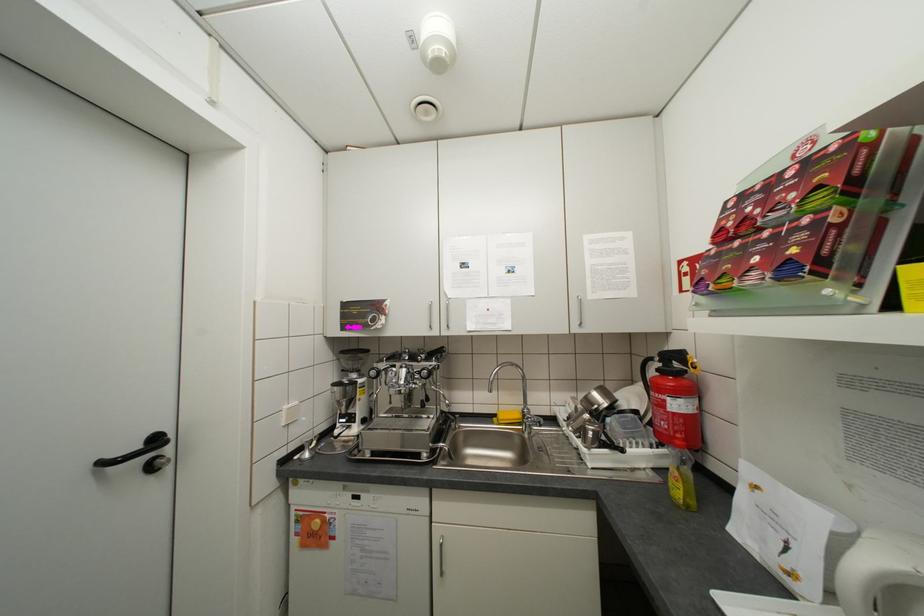
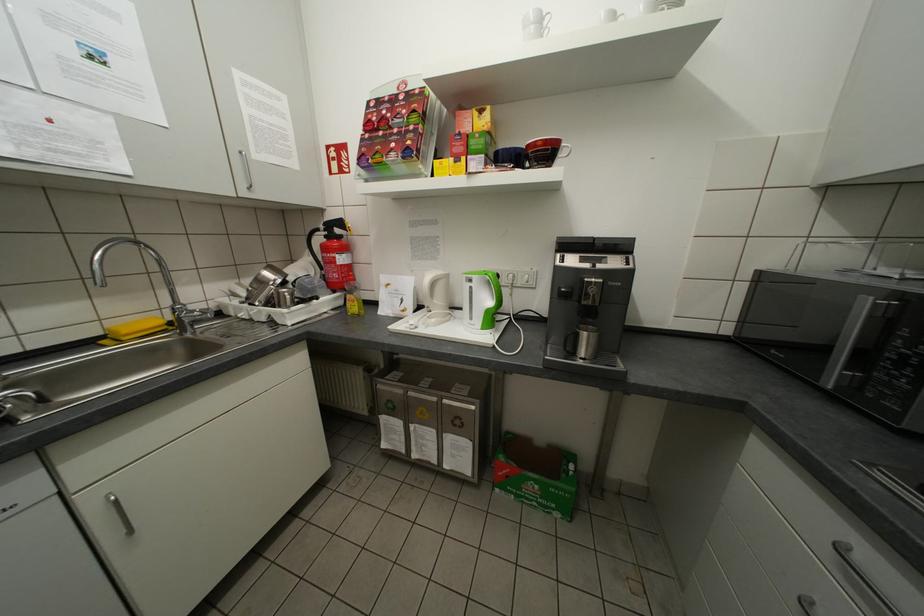
How did the camera likely rotate?

The rotation direction of the camera is right-down.